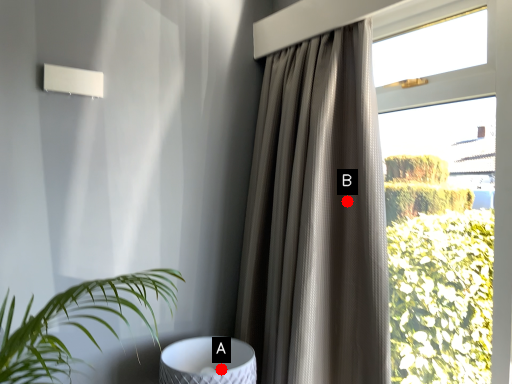
Question: Two points are circled on the image, labeled by A and B beside each circle. Which of the following is the farthest from the observer?

Choices:
 (A) A is further
 (B) B is further

Answer: (B)